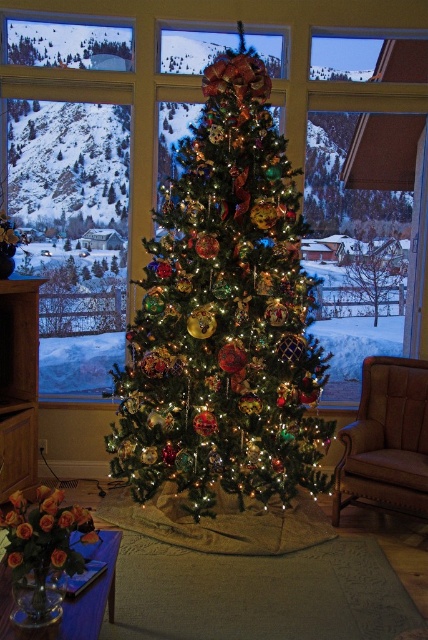
Question: Is brown leather armchair at right bigger than green matte tree at center?

Choices:
 (A) no
 (B) yes

Answer: (B)

Question: Does transparent glass window at center lie behind brown leather armchair at right?

Choices:
 (A) yes
 (B) no

Answer: (A)

Question: Which of the following is the farthest from the observer?

Choices:
 (A) transparent glass window at center
 (B) green matte tree at center

Answer: (B)

Question: Is shiny green christmas tree at center positioned before brown leather armchair at right?

Choices:
 (A) no
 (B) yes

Answer: (B)

Question: Among these objects, which one is farthest from the camera?

Choices:
 (A) shiny green christmas tree at center
 (B) transparent glass window at center

Answer: (B)

Question: Based on their relative distances, which object is nearer to the brown leather armchair at right?

Choices:
 (A) shiny green christmas tree at center
 (B) green matte tree at center

Answer: (A)